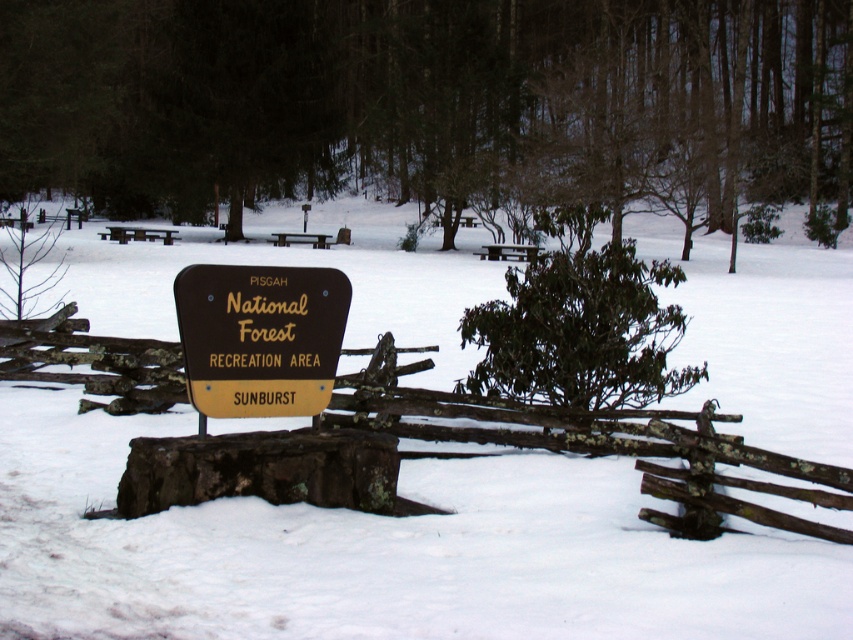
Question: Does green leafy tree at center lie behind brown wooden fence at center?

Choices:
 (A) no
 (B) yes

Answer: (B)

Question: Can you confirm if brown wooden fence at center is thinner than brown wood sign at center?

Choices:
 (A) yes
 (B) no

Answer: (B)

Question: Among these objects, which one is nearest to the camera?

Choices:
 (A) green leafy bush at center
 (B) brown wood sign at center
 (C) brown wooden fence at center

Answer: (C)

Question: Which object is the farthest from the green leafy bush at center?

Choices:
 (A) green leafy tree at center
 (B) brown wood sign at center
 (C) brown wooden fence at center

Answer: (A)

Question: Which of the following is the closest to the observer?

Choices:
 (A) (636, 323)
 (B) (436, 432)
 (C) (294, 291)

Answer: (C)

Question: In this image, where is brown wooden fence at center located relative to green leafy bush at center?

Choices:
 (A) above
 (B) below

Answer: (B)